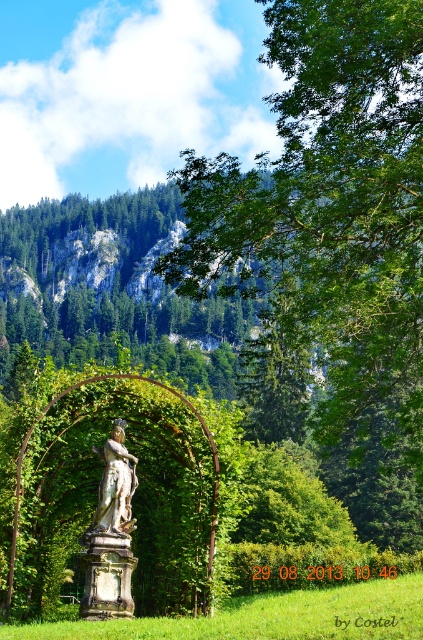
You are an art curator planning to display both the bronze statue at center and the white marble statue at center in a gallery. Given their sizes, which statue would require a wider base to remain stable?

The bronze statue at center requires a wider base because its width is larger than the white marble statue at center, ensuring stability.

You are a landscape architect designing a garden pathway that needs to pass between the bronze statue at center and the white marble statue at center. Based on their positions, which direction should the pathway be placed to ensure it stays between them?

The bronze statue at center is below the white marble statue at center, so the pathway should be placed between them horizontally, not vertically, to stay between them.

Consider the image. You are a landscape architect designing a pathway that needs to pass exactly 1 meter to the north of the bronze statue at center. Given the statue is at coordinates 0.834, 0.262, where should the pathway be placed?

The pathway should be placed at coordinates (110,532) plus 1 meter north. However, without knowing the scale of the coordinate system, precise placement isn